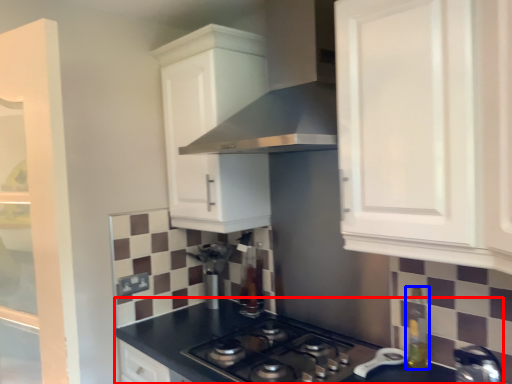
Question: Which point is further to the camera, countertop (highlighted by a red box) or bottle (highlighted by a blue box)?

Choices:
 (A) countertop
 (B) bottle

Answer: (B)